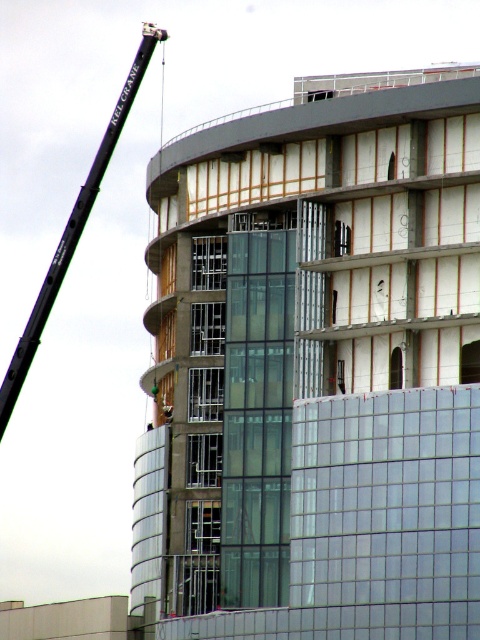
Which of these two, clear glass building at center or black metal crane at upper left, stands taller?

With more height is black metal crane at upper left.

Which is more to the right, clear glass building at center or black metal crane at upper left?

From the viewer's perspective, clear glass building at center appears more on the right side.

This screenshot has width=480, height=640. In order to click on clear glass building at center in this screenshot , I will do `click(316, 365)`.

Locate an element on the screen. The width and height of the screenshot is (480, 640). clear glass building at center is located at coordinates (316, 365).